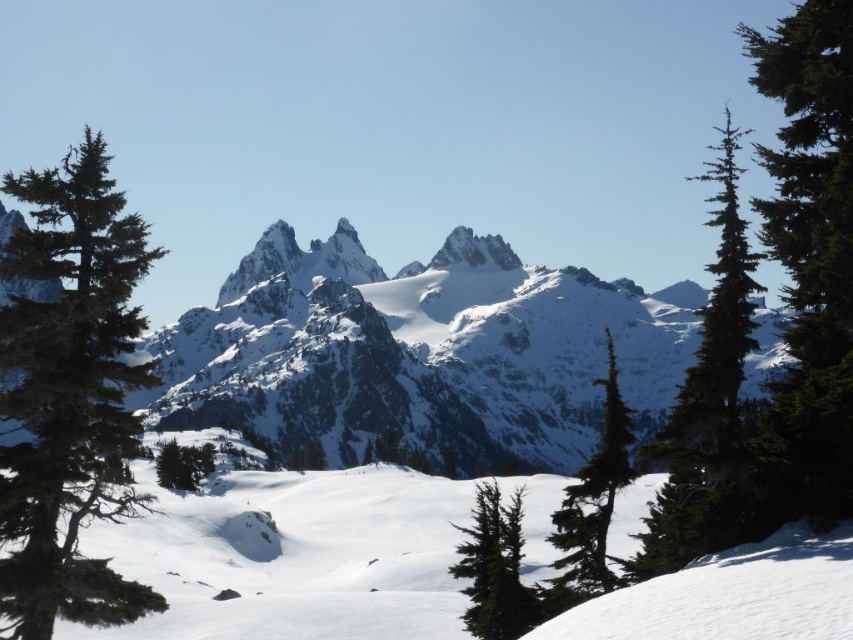
You are a hiker planning to navigate from the green matte tree at lower left to the green matte tree at center. Based on the scene, which direction should you head to reach your destination?

The green matte tree at center is to the right of the green matte tree at lower left, so you should head towards the right direction to reach it.

You are an environmental scientist assessing the health of trees in this mountainous area. You observe the green matte tree at center and the green matte tree at lower left. Which tree has a smaller width?

The green matte tree at center has a smaller width than the green matte tree at lower left.

You are standing at the center of the snowfield and see the green matte tree at lower right and the green matte tree at lower left. Which tree is closer to your right side?

The green matte tree at lower right is positioned on the right side of green matte tree at lower left, so it is closer to your right side.